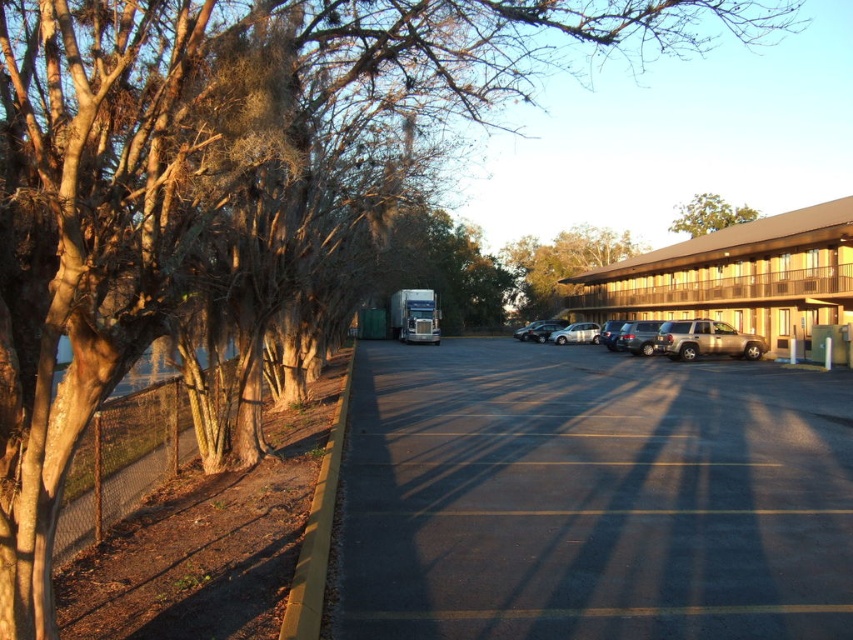
You are standing at the point labeled as point (x=590, y=497) in the parking lot. Looking around, you see the black asphalt parking lot at center. Which direction should you walk to reach the row of trees with bare branches on the left side of the image?

Since the row of trees with bare branches is on the left side of the image and you are currently at the point indicating the black asphalt parking lot at center, you should walk towards the left side of the image to reach the trees.

Looking at this image, you are a delivery driver who needs to park your truck in the parking lot. The truck requires a space of 12 meters in length. Can you safely park your truck in the black asphalt parking lot at center without crossing the smooth asphalt line at center?

The distance between the black asphalt parking lot at center and the smooth asphalt line at center is 10.44 meters. Since the truck requires 12 meters, it is not possible to park safely without crossing the line.

You are a delivery driver who needs to park your vehicle in the parking lot. The motel is at the right side. Which object is taller between the black asphalt parking lot at center and the beige wood motel at right?

The beige wood motel at right is taller than the black asphalt parking lot at center.